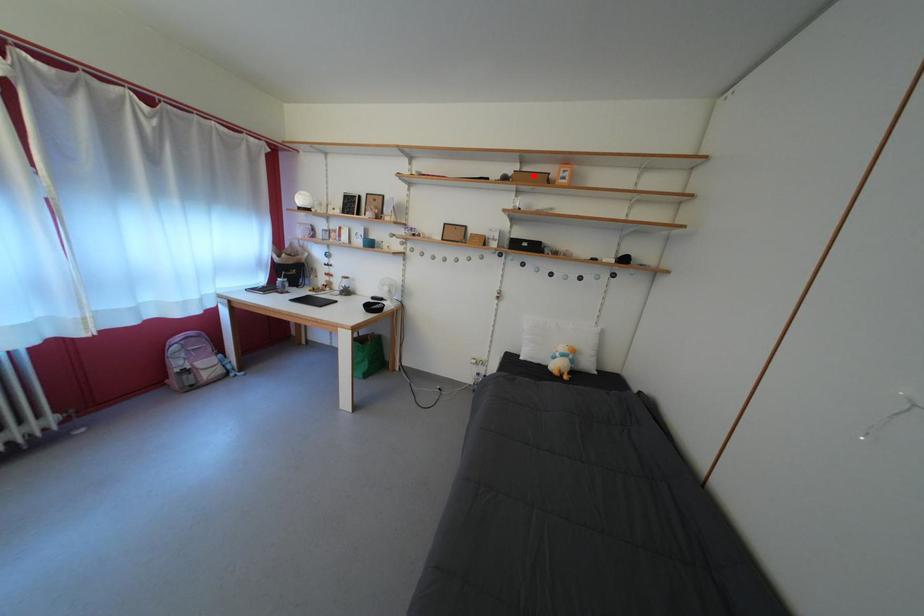
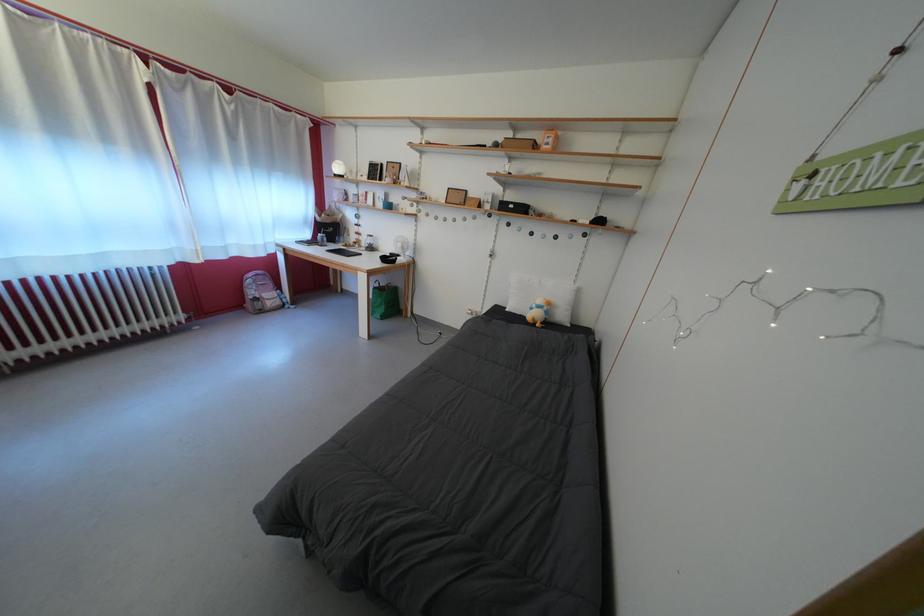
Locate, in the second image, the point that corresponds to the highlighted location in the first image.

(527, 142)